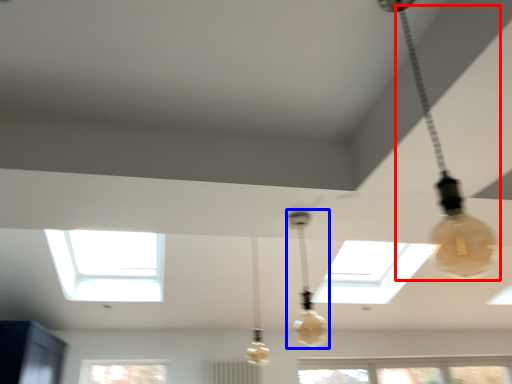
Question: Among these objects, which one is nearest to the camera, lamp (highlighted by a red box) or lamp (highlighted by a blue box)?

Choices:
 (A) lamp
 (B) lamp

Answer: (A)